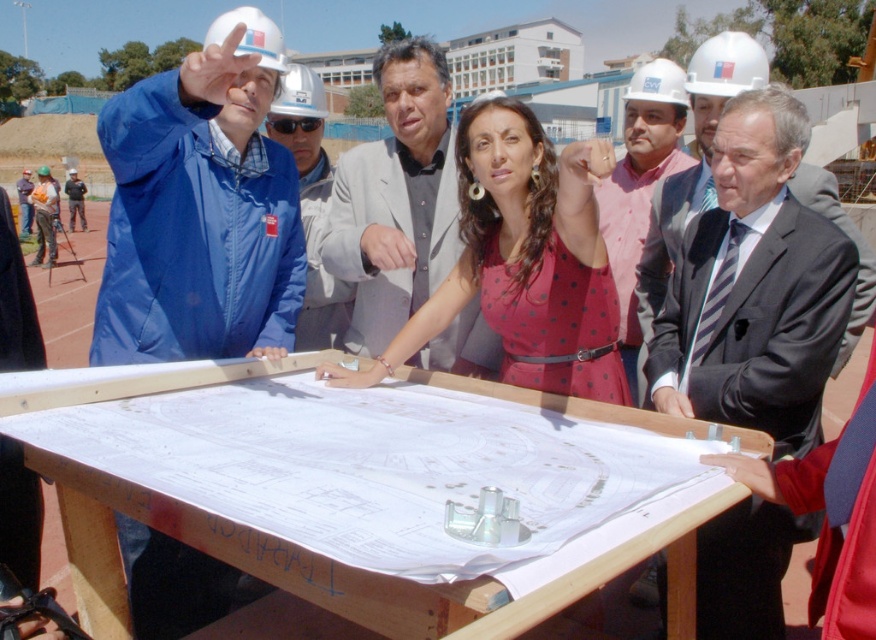
Which is below, striped tie suit at center or matte pink shirt at center?

striped tie suit at center

Is striped tie suit at center above matte pink shirt at center?

Actually, striped tie suit at center is below matte pink shirt at center.

Does point (724, 204) come in front of point (676, 76)?

Yes, it is in front of point (676, 76).

This screenshot has height=640, width=876. I want to click on striped tie suit at center, so click(754, 285).

Can you confirm if matte pink shirt at center is bigger than blue fabric jacket at upper left?

Actually, matte pink shirt at center might be smaller than blue fabric jacket at upper left.

Is point (643, 209) behind point (313, 234)?

No, it is in front of (313, 234).

At what (x,y) coordinates should I click in order to perform the action: click on matte pink shirt at center. Please return your answer as a coordinate pair (x, y). Looking at the image, I should click on (640, 186).

Who is more distant from viewer, (189, 209) or (338, 330)?

The point (338, 330) is more distant.

Is blue fabric jacket at left above blue fabric jacket at upper left?

No, blue fabric jacket at left is not above blue fabric jacket at upper left.

Who is more forward, (x=136, y=536) or (x=309, y=214)?

Point (x=136, y=536) is in front.

Identify the location of blue fabric jacket at left. The height and width of the screenshot is (640, 876). (201, 209).